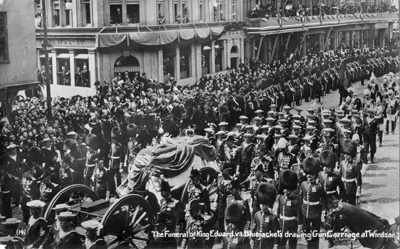
Where is `sheet`? sheet is located at coordinates (155, 161).